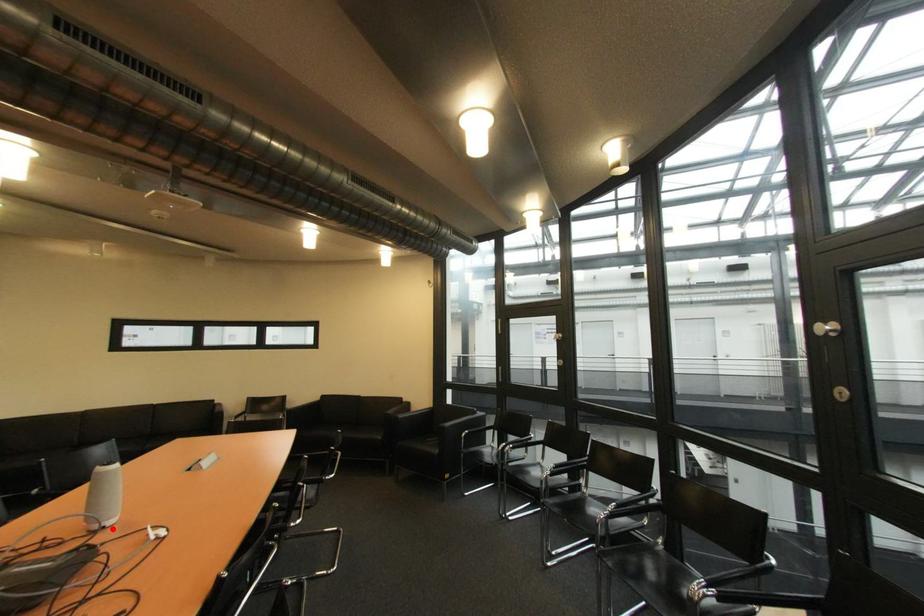
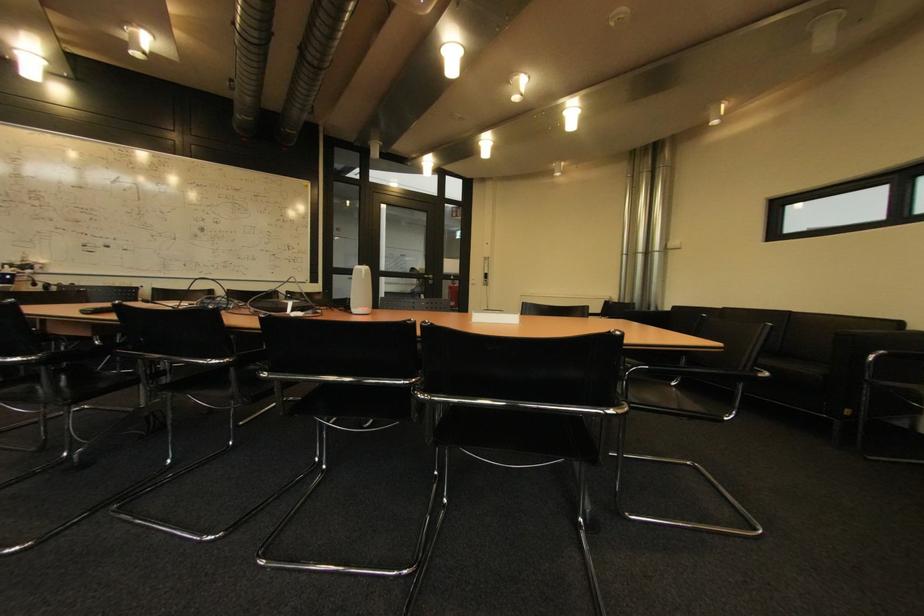
Locate, in the second image, the point that corresponds to the highlighted location in the first image.

(359, 314)